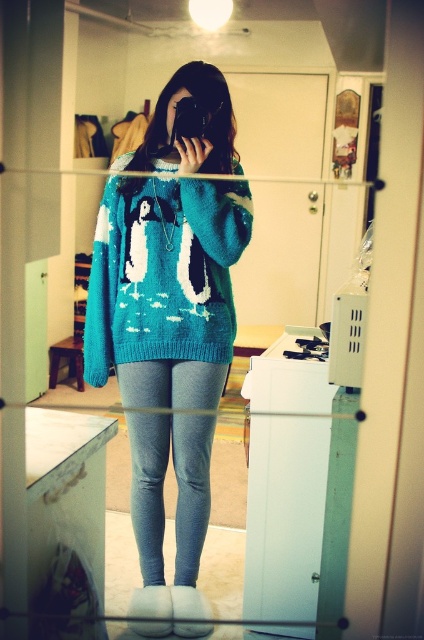
You are helping someone organize their closet. They have a turquoise knitted sweater at center and a teal knitted sweater at center. They want to arrange them so the turquoise one is to the left of the teal one. Is the current arrangement correct?

The turquoise knitted sweater at center is positioned on the right side of teal knitted sweater at center. Therefore, the current arrangement is incorrect because the turquoise sweater is to the right, not the left of the teal one.

You are a fashion designer analyzing the outfit in the image. The teal knitted sweater at center and gray knit leggings at center are part of the outfit. Which item has a greater width?

The teal knitted sweater at center has a greater width than the gray knit leggings at center according to the description.

You are a fashion designer looking at the image of a person wearing a turquoise knitted sweater at center and gray knit leggings at center. Which piece of clothing is larger in size?

The turquoise knitted sweater at center is larger than the gray knit leggings at center.